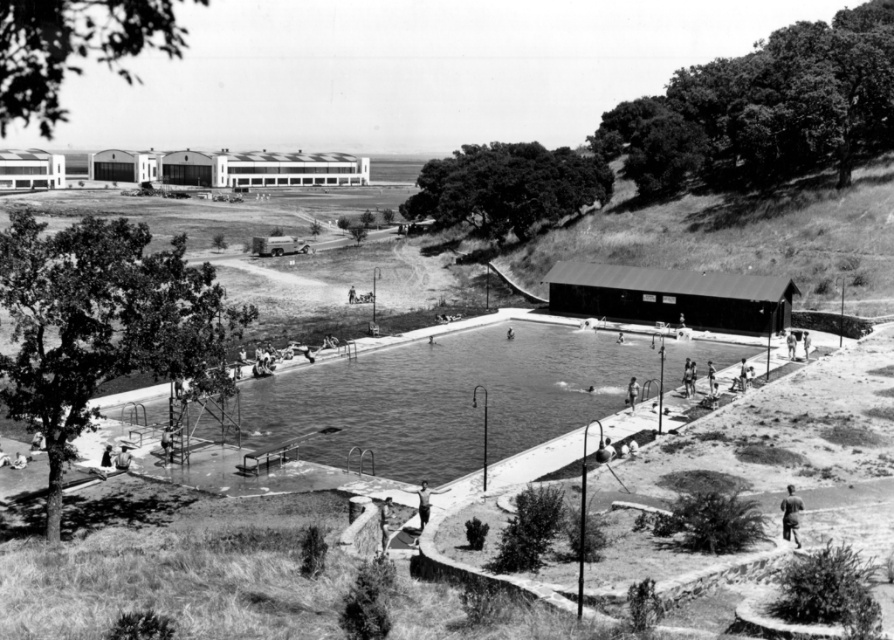
Question: Considering the real-world distances, which object is farthest from the smooth skin person at lower right?

Choices:
 (A) smooth skin person at lower left
 (B) smooth skin person at center
 (C) dark brown leather jacket at lower right
 (D) smooth skin person at lower center

Answer: (A)

Question: Can you confirm if smooth concrete pool at center is positioned to the right of smooth skin person at lower left?

Choices:
 (A) yes
 (B) no

Answer: (A)

Question: Which object appears farthest from the camera in this image?

Choices:
 (A) dark brown leather jacket at lower right
 (B) smooth concrete pool at center

Answer: (B)

Question: Can you confirm if smooth skin person at lower left is bigger than smooth skin person at lower right?

Choices:
 (A) no
 (B) yes

Answer: (A)

Question: Which object is positioned closest to the dark brown leather jacket at lower right?

Choices:
 (A) smooth skin person at lower left
 (B) smooth skin person at lower center
 (C) smooth skin person at lower right
 (D) smooth concrete pool at center

Answer: (B)

Question: Is smooth skin person at lower left behind smooth skin person at lower right?

Choices:
 (A) no
 (B) yes

Answer: (A)